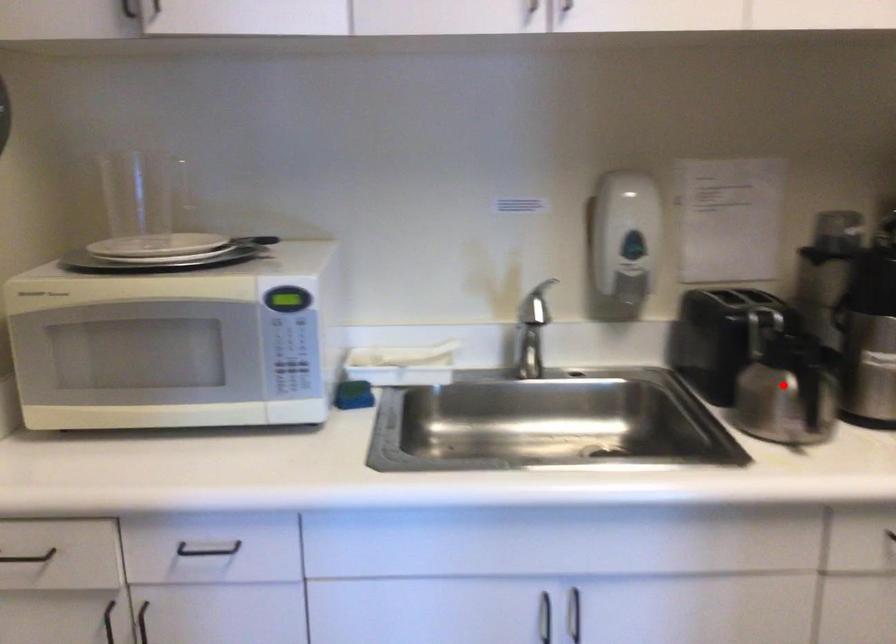
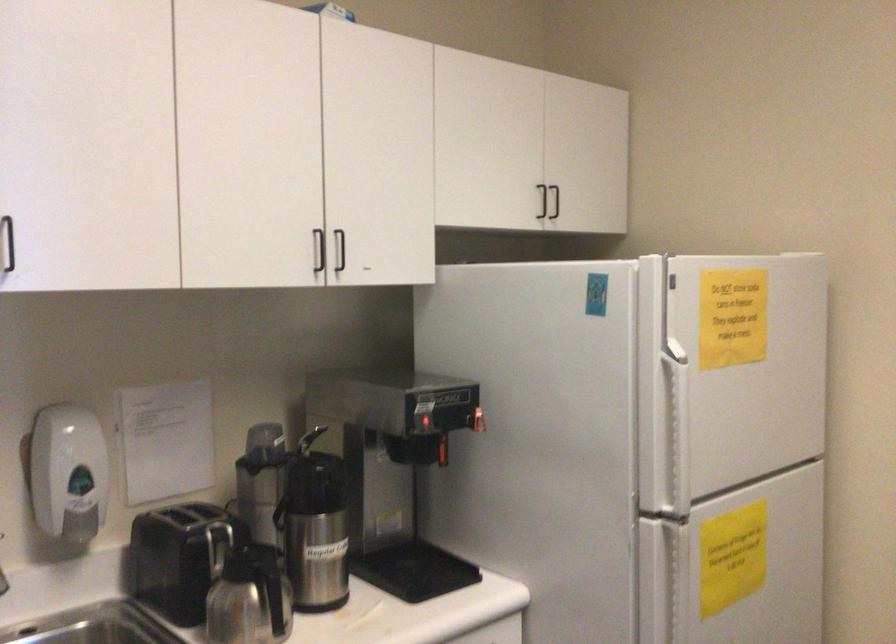
Question: I am providing you with two images of the same scene from different viewpoints. In image1, a red point is highlighted. Considering the same 3D point in image2, which of the following is correct?

Choices:
 (A) It is closer
 (B) It is farther

Answer: (B)